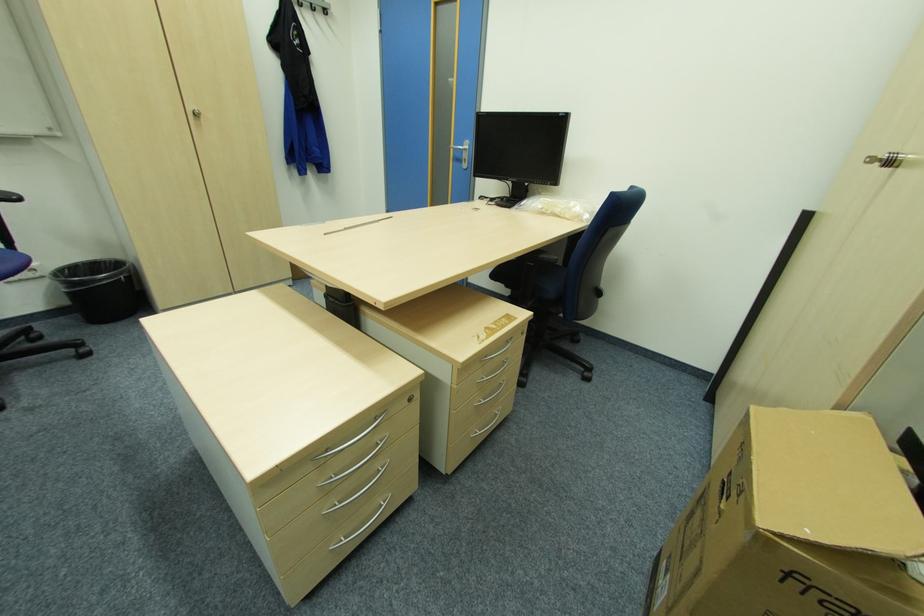
What do you see at coordinates (460, 148) in the screenshot? Image resolution: width=924 pixels, height=616 pixels. I see `the silver door handle` at bounding box center [460, 148].